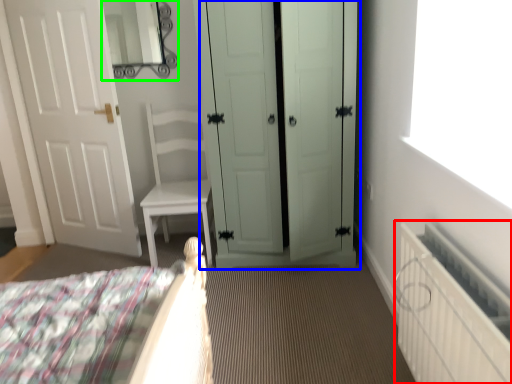
Question: Which object is the closest to the radiator (highlighted by a red box)? Choose among these: door (highlighted by a blue box) or mirror (highlighted by a green box).

Choices:
 (A) door
 (B) mirror

Answer: (A)